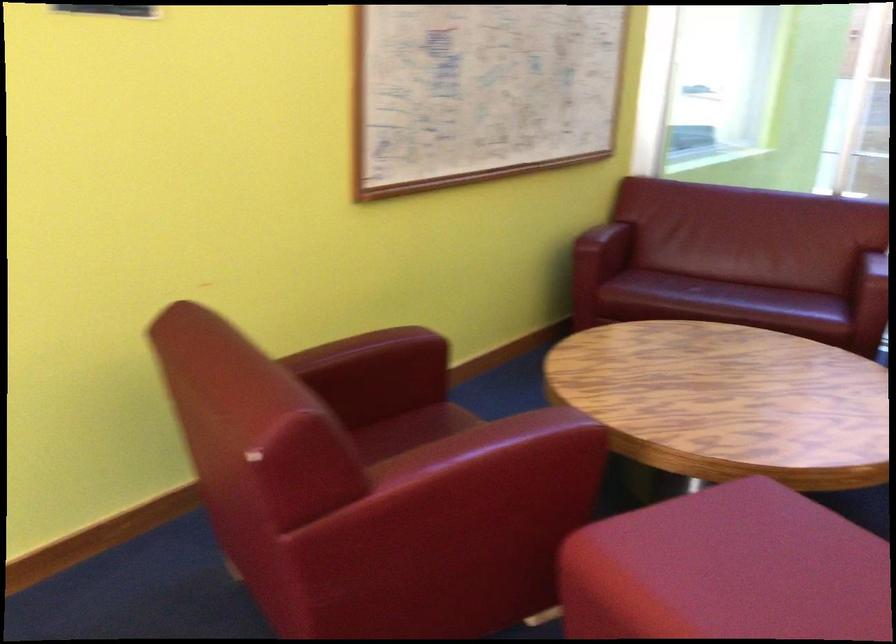
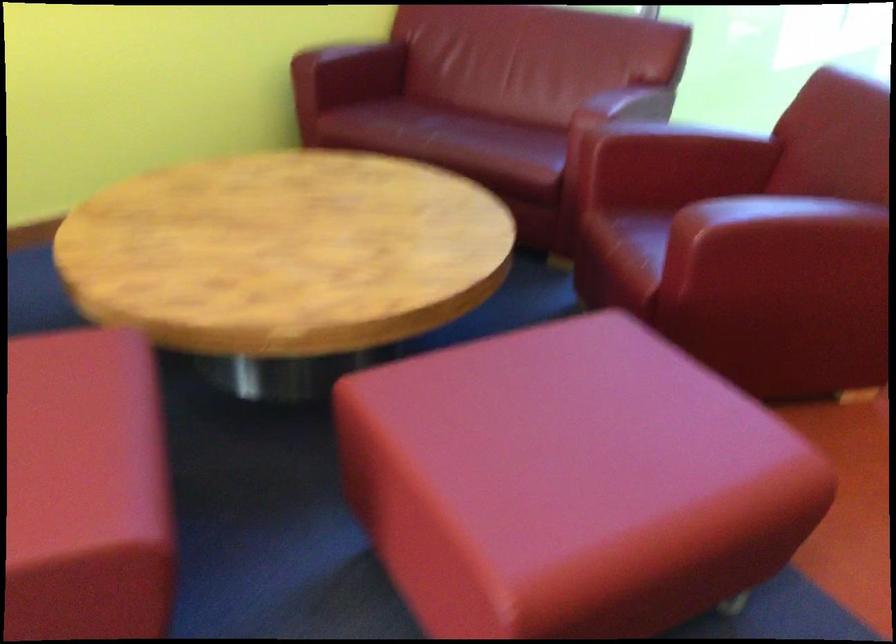
Question: In a continuous first-person perspective shot, in which direction is the camera moving?

Choices:
 (A) Left
 (B) Right
 (C) Forward
 (D) Backward

Answer: (B)